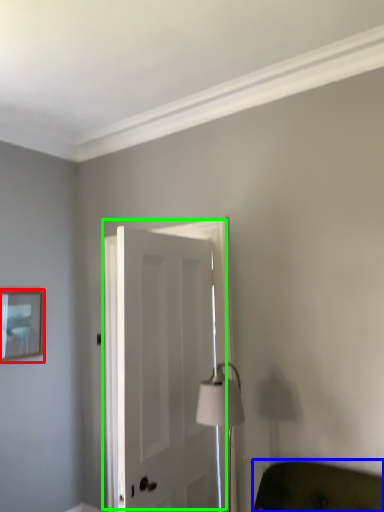
Question: Which is farther away from picture frame (highlighted by a red box)? furniture (highlighted by a blue box) or door (highlighted by a green box)?

Choices:
 (A) furniture
 (B) door

Answer: (A)